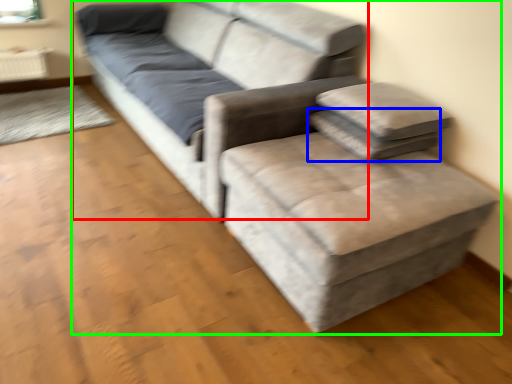
Question: Which object is positioned farthest from couch (highlighted by a red box)? Select from pillow (highlighted by a blue box) and studio couch (highlighted by a green box).

Choices:
 (A) pillow
 (B) studio couch

Answer: (A)